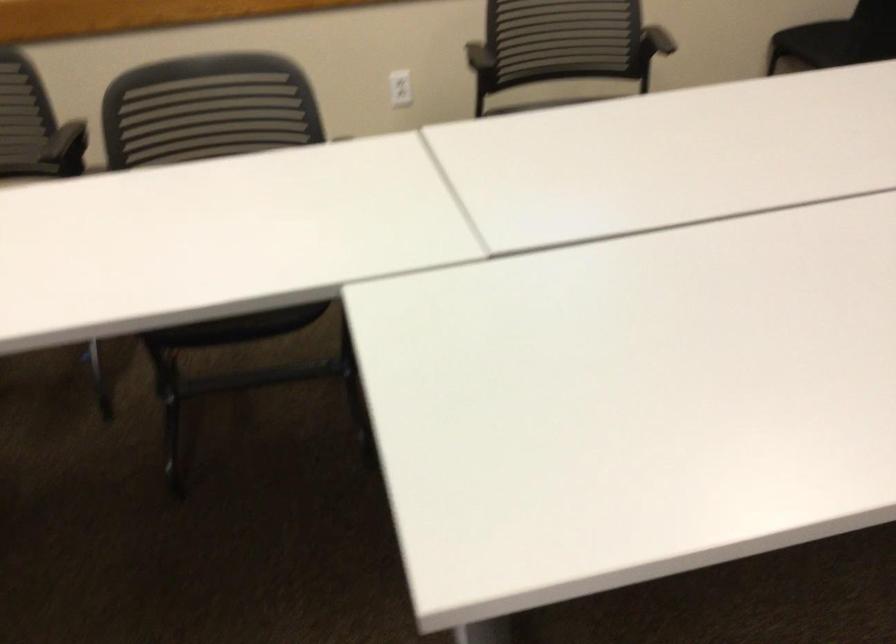
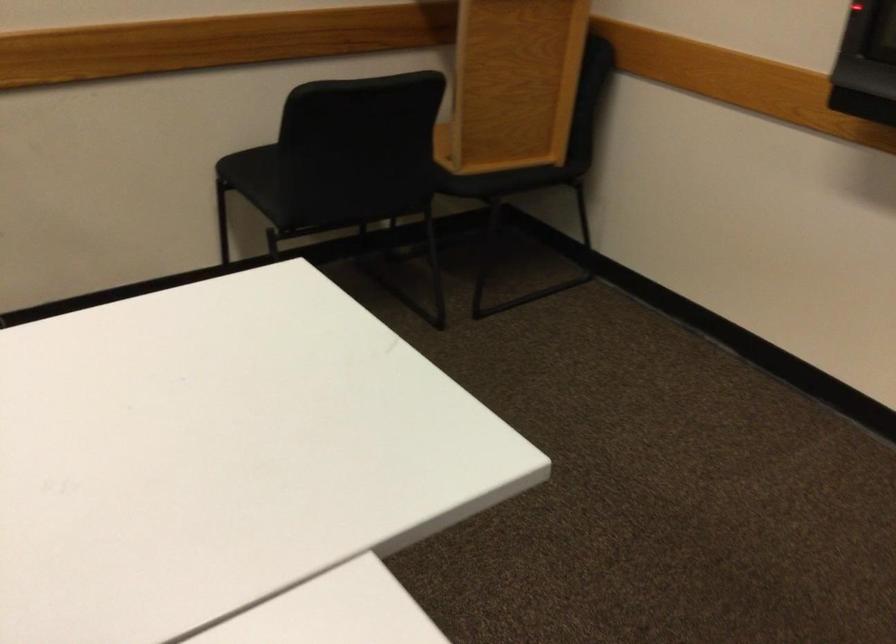
Which direction would the cameraman need to move to produce the second image?

The movement direction of the cameraman is right, forward.